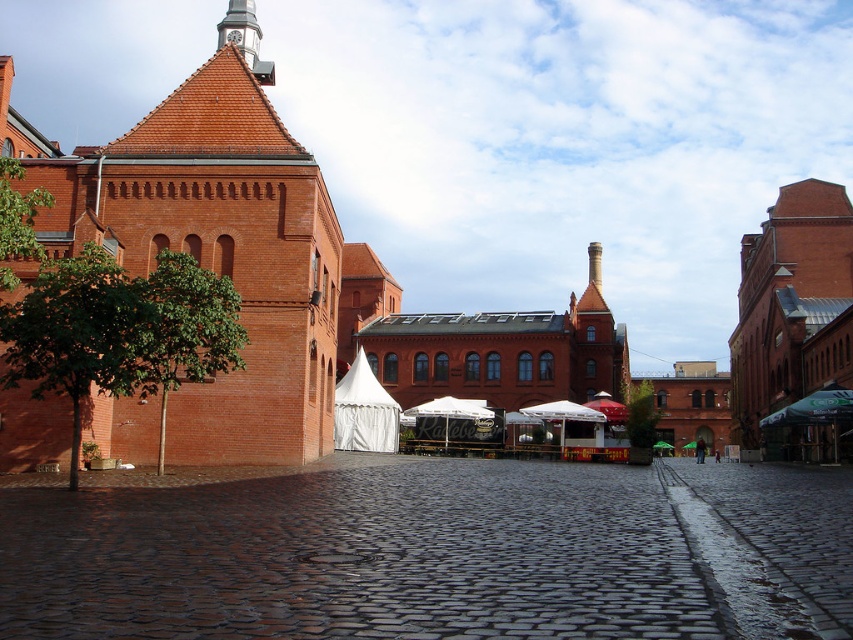
You are standing in the cobblestone square and want to find the dark cobblestone alley at center. According to the coordinates provided, where should you look to find it?

The dark cobblestone alley at center is located at coordinates point (x=431, y=550), so you should look towards the center of the square to find it.

You are a tourist in the square and want to take a photo of the white canvas tent at center and the dark cobblestone alley at center. Which one should you focus on first if you want to capture both in one shot without moving the camera?

You should focus on the white canvas tent at center first because the dark cobblestone alley at center is to its right, so adjusting the framing to include both would require ensuring the alley is within the right side of the frame.